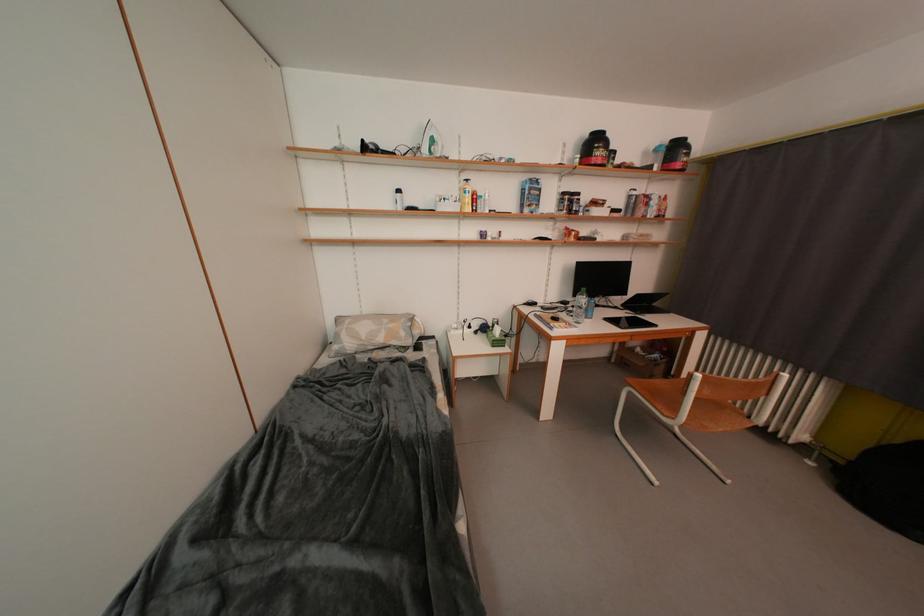
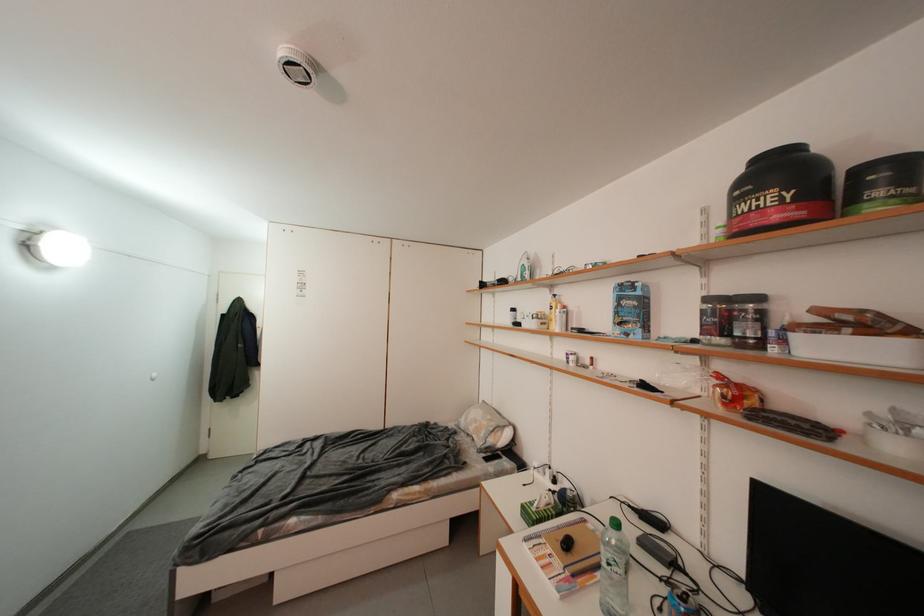
In the second image, find the point that corresponds to [586,197] in the first image.

(766, 301)